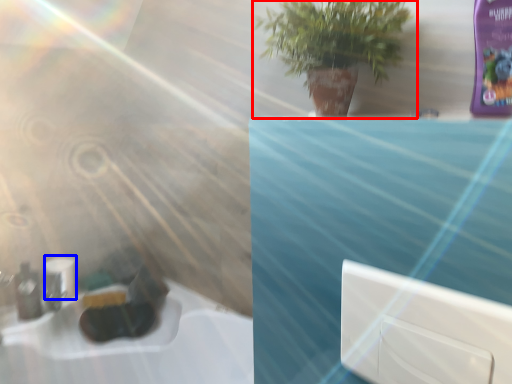
Question: Which object appears closest to the camera in this image, houseplant (highlighted by a red box) or toilet paper (highlighted by a blue box)?

Choices:
 (A) houseplant
 (B) toilet paper

Answer: (A)